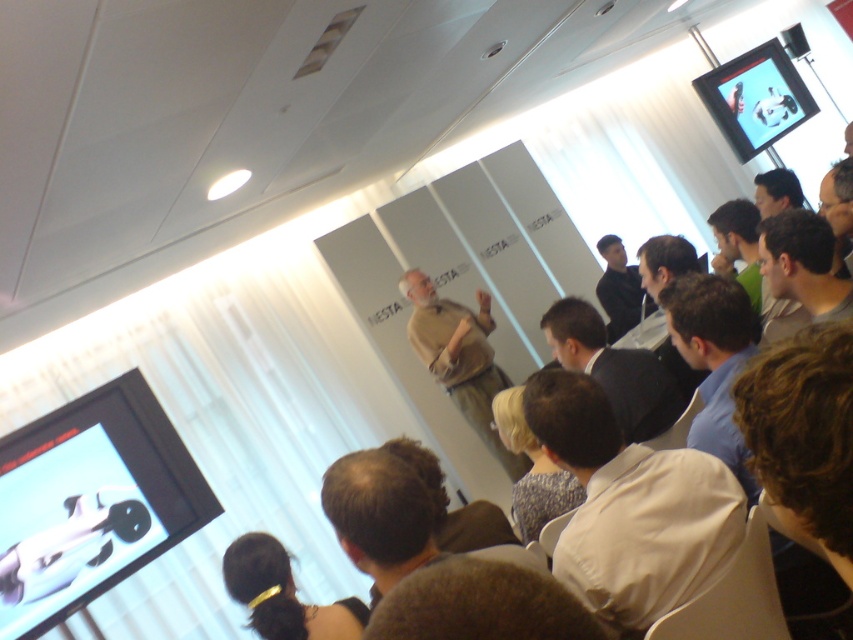
You are a photographer taking a picture of the presenter in the scene. The presenter is wearing a white cotton shirt at lower center and has dark brown hair at lower center. Which item is positioned higher on the presenter?

The white cotton shirt at lower center is located above the dark brown hair at lower center, so the white cotton shirt at lower center is positioned higher on the presenter.

You are an attendee at the presentation and want to hand a note to the presenter. You notice the beige fabric shirt at center and the dark suit jacket at center. Which one is closer to you so you can approach them?

The beige fabric shirt at center is closer to you than the dark suit jacket at center, so you should approach the beige fabric shirt at center.